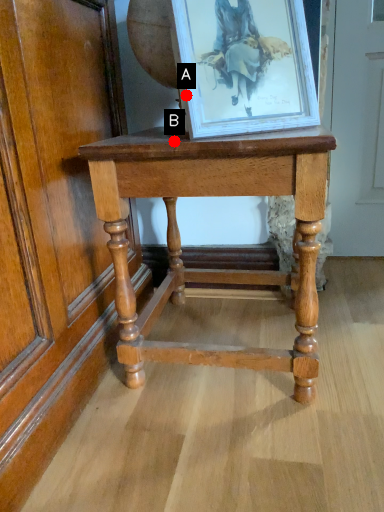
Question: Two points are circled on the image, labeled by A and B beside each circle. Which point is closer to the camera?

Choices:
 (A) A is closer
 (B) B is closer

Answer: (B)